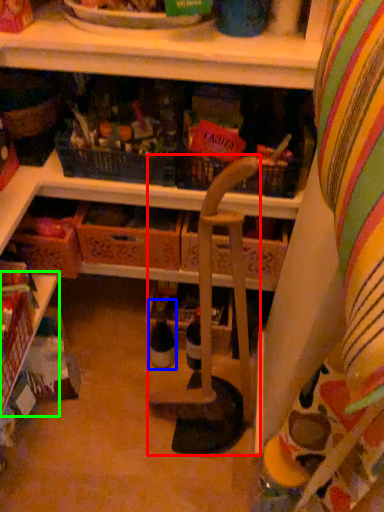
Question: Based on their relative distances, which object is nearer to armchair (highlighted by a red box)? Choose from bottle (highlighted by a blue box) and shelf (highlighted by a green box).

Choices:
 (A) bottle
 (B) shelf

Answer: (A)